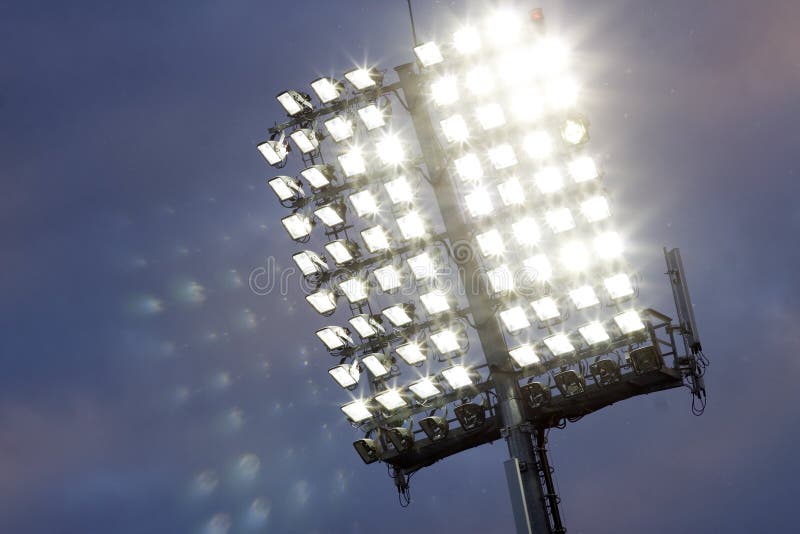
The width and height of the screenshot is (800, 534). In order to click on unlit light bulbs in this screenshot , I will do `click(366, 445)`, `click(396, 438)`, `click(438, 425)`, `click(465, 412)`, `click(542, 399)`, `click(574, 376)`, `click(612, 379)`, `click(642, 357)`.